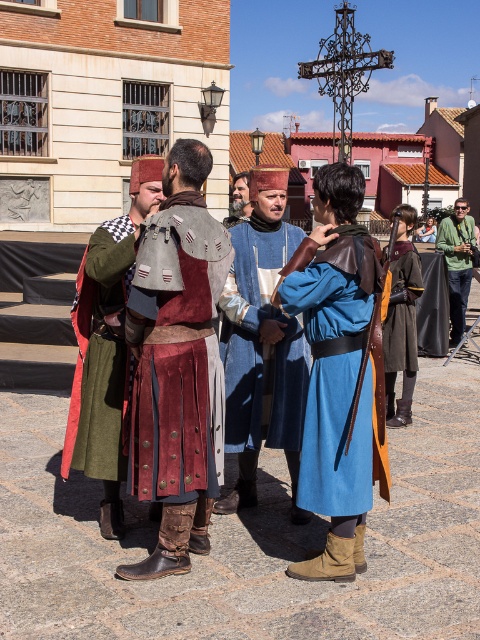
Question: Does blue woolen robe at center appear under green fabric jacket at right?

Choices:
 (A) yes
 (B) no

Answer: (A)

Question: Is green woolen tunic at left positioned before green fabric jacket at right?

Choices:
 (A) no
 (B) yes

Answer: (B)

Question: Is blue woolen robe at center smaller than green fabric jacket at right?

Choices:
 (A) no
 (B) yes

Answer: (A)

Question: Considering the real-world distances, which object is closest to the green woolen tunic at left?

Choices:
 (A) blue woolen robe at center
 (B) velvet brown tunic at center
 (C) green fabric jacket at right
 (D) blue woolen tunic at center

Answer: (B)

Question: Which object is positioned closest to the green fabric jacket at right?

Choices:
 (A) green woolen tunic at left
 (B) blue woolen tunic at center
 (C) blue woolen robe at center
 (D) velvet brown tunic at center

Answer: (B)

Question: Which object appears closest to the camera in this image?

Choices:
 (A) velvet brown tunic at center
 (B) green woolen tunic at left

Answer: (A)